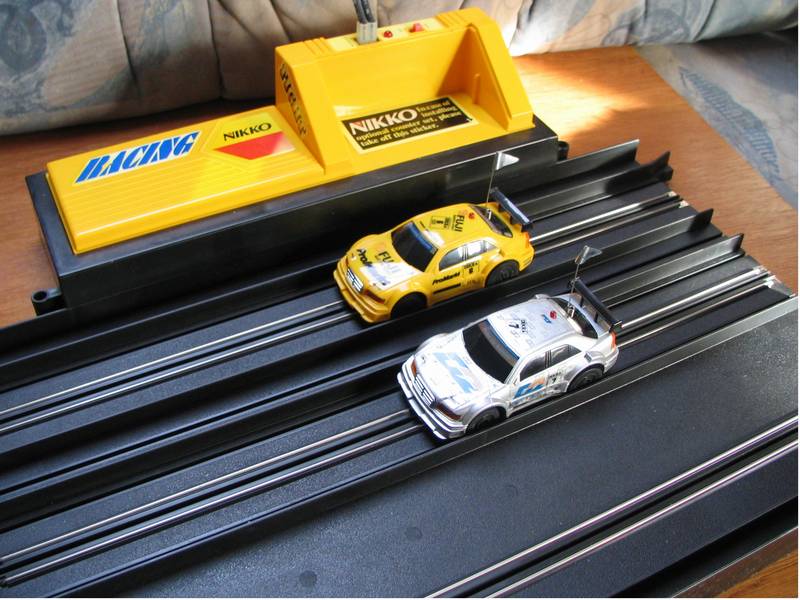
Locate an element on the screen. The image size is (800, 600). black cord is located at coordinates (362, 10).